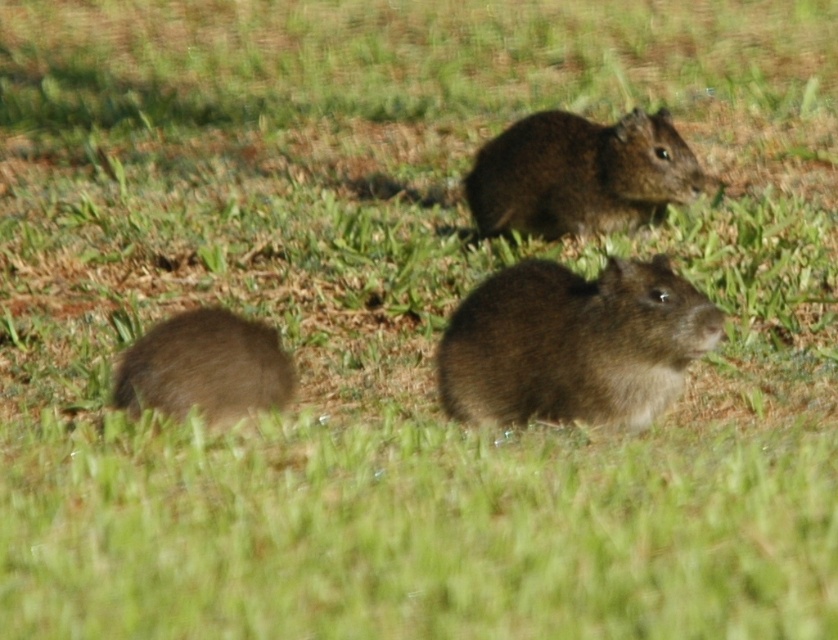
Based on the photo, you are a wildlife photographer aiming to capture a closeup shot of the brown furry mouse at center and the brown furry mouse at lower left. Given that your camera lens can focus on objects within a 50cm range, which mouse should you prioritize to ensure the best focus?

The brown furry mouse at center is larger in size compared to the brown furry mouse at lower left, so prioritizing the brown furry mouse at center will ensure better focus within the 50cm range.

Based on the photo, you are observing three agoutis in a grassy field. You notice two specific points marked as point 1 at coordinates point [521,296] and point 2 at coordinates point [668,120]. Which point is closer to you?

Point 1 at coordinates point [521,296] is closer to you because it is in front of point 2 at coordinates point [668,120].

You are a wildlife photographer aiming to capture a photo of the brown furry mouse at center and the brown furry mouse at lower left. If you want to frame both mice in a single shot without moving your camera, which mouse should you position closer to the left edge of the frame?

You should position the brown furry mouse at lower left closer to the left edge of the frame since it is already to the left of the brown furry mouse at center.